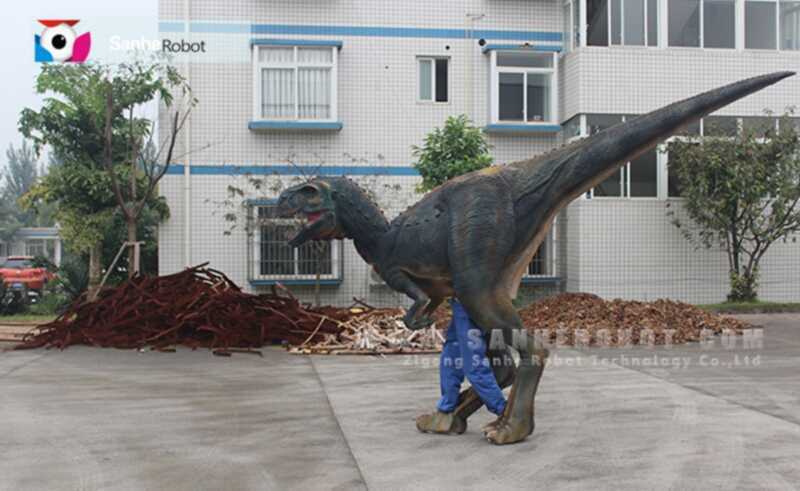
This screenshot has height=491, width=800. In order to click on window in this screenshot , I will do `click(306, 74)`, `click(300, 255)`, `click(542, 89)`, `click(437, 82)`, `click(708, 27)`, `click(784, 27)`, `click(617, 25)`, `click(646, 182)`.